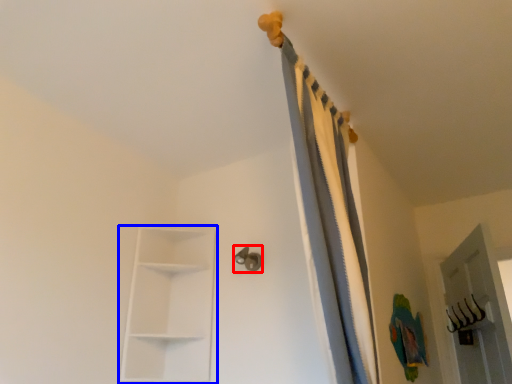
Question: Among these objects, which one is nearest to the camera, door handle (highlighted by a red box) or shelf (highlighted by a blue box)?

Choices:
 (A) door handle
 (B) shelf

Answer: (B)